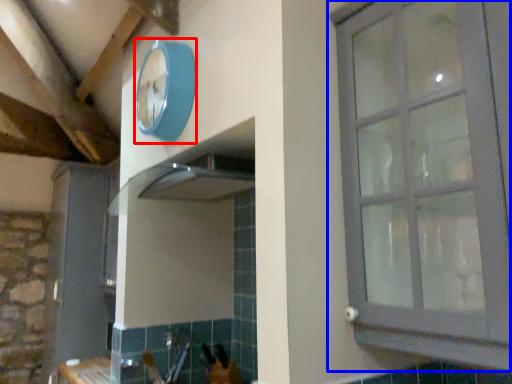
Question: Which object is further to the camera taking this photo, clock (highlighted by a red box) or window (highlighted by a blue box)?

Choices:
 (A) clock
 (B) window

Answer: (A)